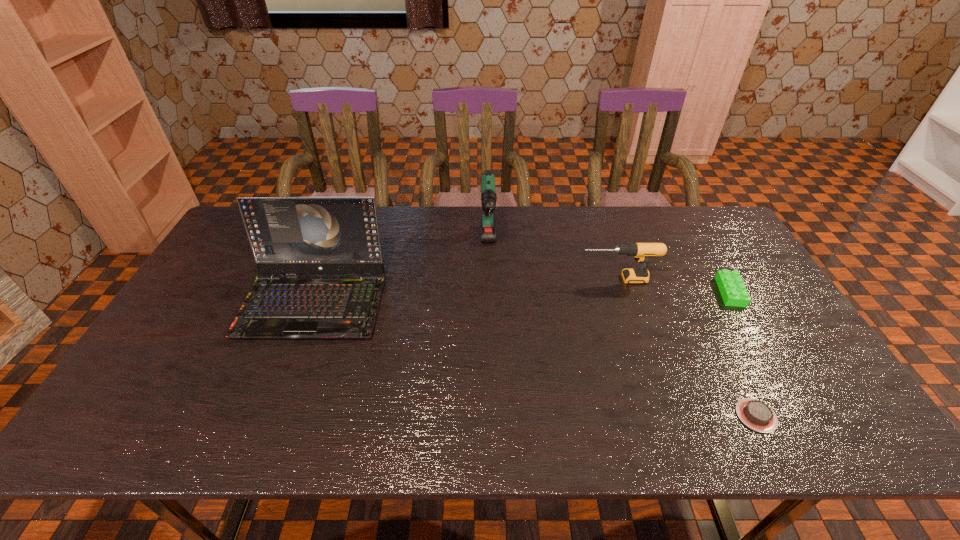
Locate an element on the screen. This screenshot has width=960, height=540. laptop computer is located at coordinates (289, 235).

The image size is (960, 540). What are the coordinates of `the taller drill` in the screenshot? It's located at (488, 197).

This screenshot has width=960, height=540. What are the coordinates of `the left drill` in the screenshot? It's located at click(488, 197).

Where is `the right drill`? The width and height of the screenshot is (960, 540). the right drill is located at coordinates (642, 252).

At what (x,y) coordinates should I click in order to perform the action: click on the shorter drill. Please return your answer as a coordinate pair (x, y). This screenshot has width=960, height=540. Looking at the image, I should click on (642, 252).

Identify the location of the rightmost object. (733, 291).

Find the location of a particular element. The width and height of the screenshot is (960, 540). Lego is located at coordinates (733, 291).

I want to click on the nearest object, so click(755, 414).

Where is `the shortest object`? The height and width of the screenshot is (540, 960). the shortest object is located at coordinates (755, 414).

You are a GUI agent. You are given a task and a screenshot of the screen. Output one action in this format:
    pyautogui.click(x=<x>, y=<y>)
    Task: Click on the vacant space located 0.280m on the screen of the leftmost object
    Image resolution: width=960 pixels, height=540 pixels.
    Given the screenshot: What is the action you would take?
    pyautogui.click(x=261, y=443)